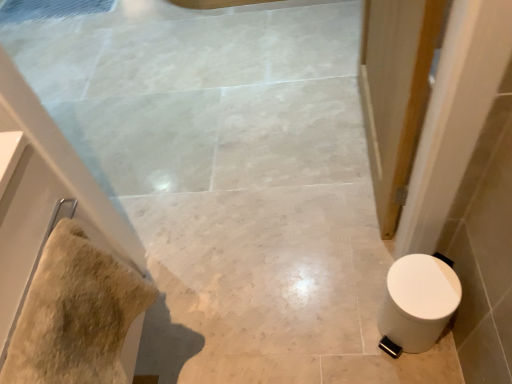
At what (x,y) coordinates should I click in order to perform the action: click on free space above white glossy toilet at lower right (from a real-world perspective). Please return your answer as a coordinate pair (x, y). This screenshot has height=384, width=512. Looking at the image, I should click on (423, 287).